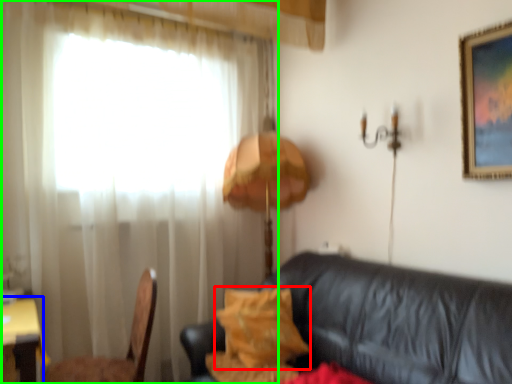
Question: Estimate the real-world distances between objects in this image. Which object is closer to pillow (highlighted by a red box), table (highlighted by a blue box) or curtain (highlighted by a green box)?

Choices:
 (A) table
 (B) curtain

Answer: (B)